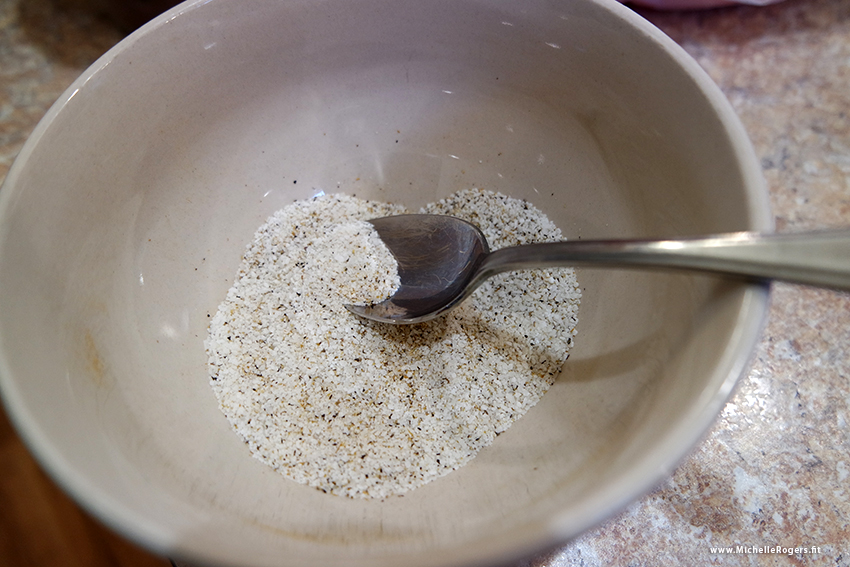
Where is `marble surface`? This screenshot has height=567, width=850. marble surface is located at coordinates (786, 427), (749, 481).